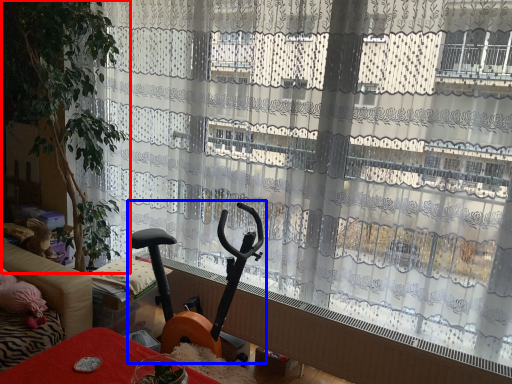
Question: Which object appears closest to the camera in this image, plant (highlighted by a red box) or baby carriage (highlighted by a blue box)?

Choices:
 (A) plant
 (B) baby carriage

Answer: (B)